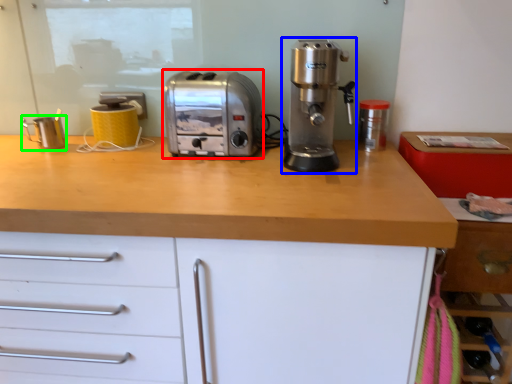
Question: Which object is the farthest from toaster (highlighted by a red box)? Choose among these: coffee machine (highlighted by a blue box) or kitchen appliance (highlighted by a green box).

Choices:
 (A) coffee machine
 (B) kitchen appliance

Answer: (B)